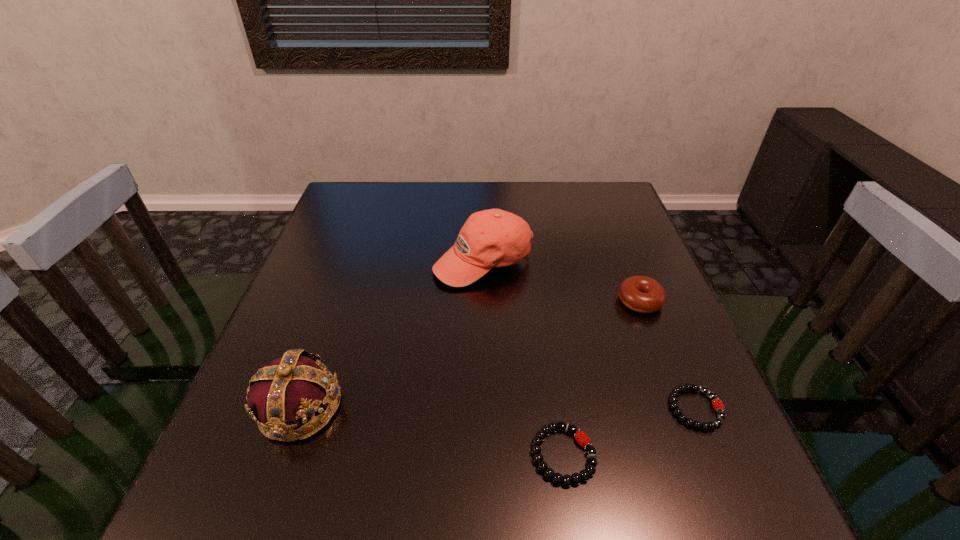
Find the location of a particular element. This screenshot has height=540, width=960. free space between the crown and the doughnut is located at coordinates (469, 354).

Where is `empty space between the baseball cap and the leftmost object`? Image resolution: width=960 pixels, height=540 pixels. empty space between the baseball cap and the leftmost object is located at coordinates (392, 334).

This screenshot has width=960, height=540. I want to click on unoccupied position between the leftmost object and the right bracelet, so click(497, 408).

Locate an element on the screen. free area in between the right bracelet and the baseball cap is located at coordinates (589, 335).

Where is `empty space between the doughnut and the crown`? Image resolution: width=960 pixels, height=540 pixels. empty space between the doughnut and the crown is located at coordinates [x=469, y=354].

The width and height of the screenshot is (960, 540). Find the location of `free space between the right bracelet and the doughnut`. free space between the right bracelet and the doughnut is located at coordinates (668, 355).

Where is `blank region between the right bracelet and the baseball cap`? The width and height of the screenshot is (960, 540). blank region between the right bracelet and the baseball cap is located at coordinates (589, 335).

At what (x,y) coordinates should I click in order to perform the action: click on empty location between the baseball cap and the left bracelet. Please return your answer as a coordinate pair (x, y). Image resolution: width=960 pixels, height=540 pixels. Looking at the image, I should click on (523, 358).

I want to click on vacant space in between the right bracelet and the third shortest object, so click(x=668, y=355).

Identify which object is the third nearest to the left bracelet. Please provide its 2D coordinates. Your answer should be formatted as a tuple, i.e. [(x, y)], where the tuple contains the x and y coordinates of a point satisfying the conditions above.

[(290, 391)]